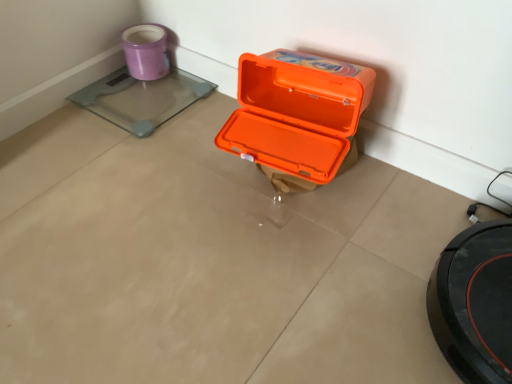
Question: Is matte purple mug at upper left at the right side of orange plastic box at center?

Choices:
 (A) no
 (B) yes

Answer: (A)

Question: Is matte purple mug at upper left looking in the opposite direction of orange plastic box at center?

Choices:
 (A) yes
 (B) no

Answer: (B)

Question: Is matte purple mug at upper left further to camera compared to orange plastic box at center?

Choices:
 (A) no
 (B) yes

Answer: (B)

Question: From the image's perspective, does matte purple mug at upper left appear higher than orange plastic box at center?

Choices:
 (A) yes
 (B) no

Answer: (A)

Question: From a real-world perspective, is matte purple mug at upper left on orange plastic box at center?

Choices:
 (A) yes
 (B) no

Answer: (B)

Question: Does matte purple mug at upper left have a greater width compared to orange plastic box at center?

Choices:
 (A) yes
 (B) no

Answer: (B)

Question: From a real-world perspective, is orange plastic box at center over matte purple mug at upper left?

Choices:
 (A) no
 (B) yes

Answer: (B)

Question: Is orange plastic box at center not within matte purple mug at upper left?

Choices:
 (A) yes
 (B) no

Answer: (A)

Question: Can you confirm if orange plastic box at center is shorter than matte purple mug at upper left?

Choices:
 (A) no
 (B) yes

Answer: (A)

Question: Is orange plastic box at center beside matte purple mug at upper left?

Choices:
 (A) no
 (B) yes

Answer: (A)

Question: Could matte purple mug at upper left be considered to be inside orange plastic box at center?

Choices:
 (A) no
 (B) yes

Answer: (A)

Question: Considering the relative sizes of orange plastic box at center and matte purple mug at upper left in the image provided, is orange plastic box at center smaller than matte purple mug at upper left?

Choices:
 (A) no
 (B) yes

Answer: (A)

Question: Is transparent glass scale at upper left behind matte purple mug at upper left?

Choices:
 (A) no
 (B) yes

Answer: (A)